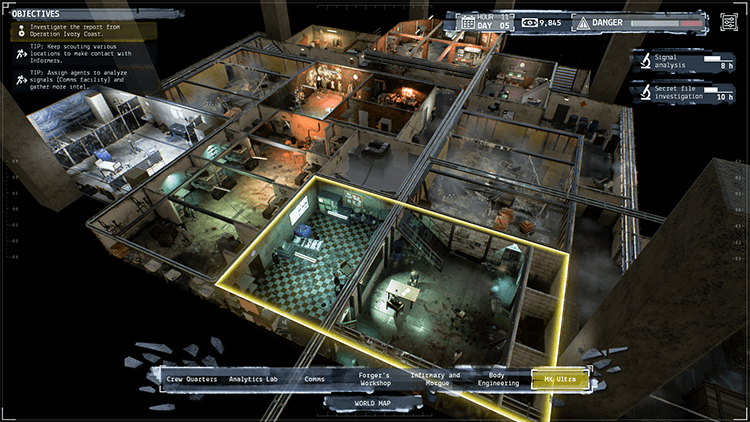
Image resolution: width=750 pixels, height=422 pixels. Find the location of `stairs`. stairs is located at coordinates (556, 73).